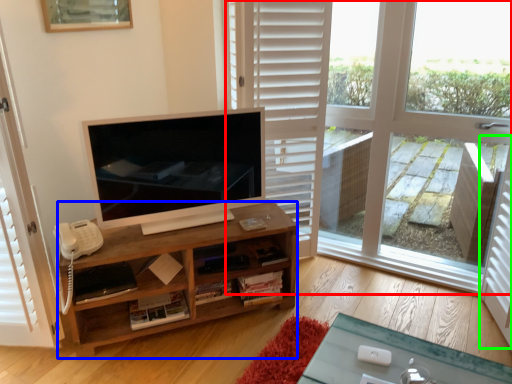
Question: Estimate the real-world distances between objects in this image. Which object is farther from window (highlighted by a red box), cabinetry (highlighted by a blue box) or screen door (highlighted by a green box)?

Choices:
 (A) cabinetry
 (B) screen door

Answer: (A)